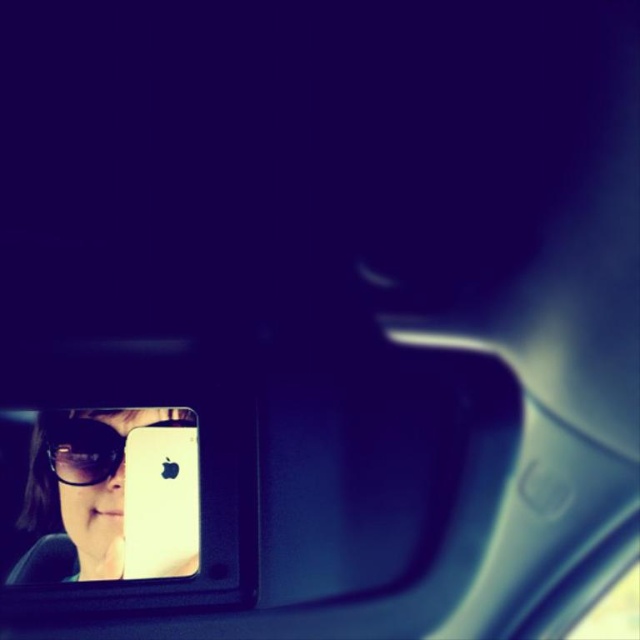
You are a passenger in the car and want to check your messages on the white matte smartphone at center without moving your head. Can you see the screen clearly while looking at the matte black sunglasses at lower left in the rearview mirror?

The matte black sunglasses at lower left is above the white matte smartphone at center in the mirror, so you can see both the sunglasses and the smartphone screen simultaneously. However, since the sunglasses are positioned above the smartphone, you might need to adjust your gaze slightly downward to focus on the screen while keeping the sunglasses in your peripheral vision.

You are a passenger in the car and want to compare the sizes of the white matte smartphone at center and the matte black goggles at lower left. Which object is bigger?

The white matte smartphone at center is larger in size than the matte black goggles at lower left.